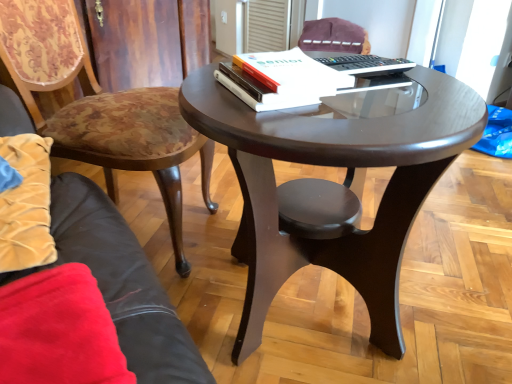
Question: Is white plastic remote control at upper center bigger than shiny dark wood coffee table at center?

Choices:
 (A) yes
 (B) no

Answer: (B)

Question: Could you tell me if white plastic remote control at upper center is facing shiny dark wood coffee table at center?

Choices:
 (A) no
 (B) yes

Answer: (B)

Question: Can you confirm if white plastic remote control at upper center is shorter than shiny dark wood coffee table at center?

Choices:
 (A) yes
 (B) no

Answer: (A)

Question: From the image's perspective, is white plastic remote control at upper center beneath shiny dark wood coffee table at center?

Choices:
 (A) no
 (B) yes

Answer: (A)

Question: Is white plastic remote control at upper center wider than shiny dark wood coffee table at center?

Choices:
 (A) yes
 (B) no

Answer: (B)

Question: Would you say shiny dark wood coffee table at center is part of white plastic remote control at upper center's contents?

Choices:
 (A) no
 (B) yes

Answer: (A)

Question: Considering the relative sizes of velvet purple chair at upper center, which ranks as the 1th chair in back-to-front order, and shiny dark wood coffee table at center in the image provided, is velvet purple chair at upper center, which ranks as the 1th chair in back-to-front order, taller than shiny dark wood coffee table at center?

Choices:
 (A) no
 (B) yes

Answer: (A)

Question: Does velvet purple chair at upper center, which ranks as the second chair in front-to-back order, have a larger size compared to shiny dark wood coffee table at center?

Choices:
 (A) yes
 (B) no

Answer: (B)

Question: Is shiny dark wood coffee table at center located within velvet purple chair at upper center, which ranks as the 1th chair in back-to-front order?

Choices:
 (A) yes
 (B) no

Answer: (B)

Question: Is the position of velvet purple chair at upper center, which ranks as the 1th chair in back-to-front order, less distant than that of shiny dark wood coffee table at center?

Choices:
 (A) no
 (B) yes

Answer: (A)

Question: From the image's perspective, is velvet purple chair at upper center, which is counted as the 2th chair, starting from the bottom, above shiny dark wood coffee table at center?

Choices:
 (A) no
 (B) yes

Answer: (B)

Question: From a real-world perspective, is velvet purple chair at upper center, the first chair when ordered from right to left, beneath shiny dark wood coffee table at center?

Choices:
 (A) yes
 (B) no

Answer: (B)

Question: Is white paper at upper center wider than white plastic remote control at upper center?

Choices:
 (A) yes
 (B) no

Answer: (B)